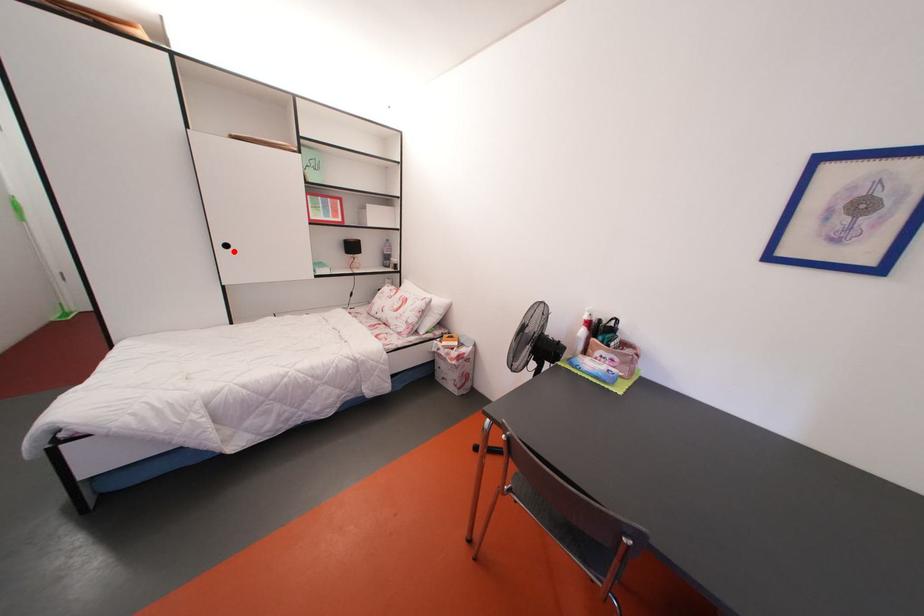
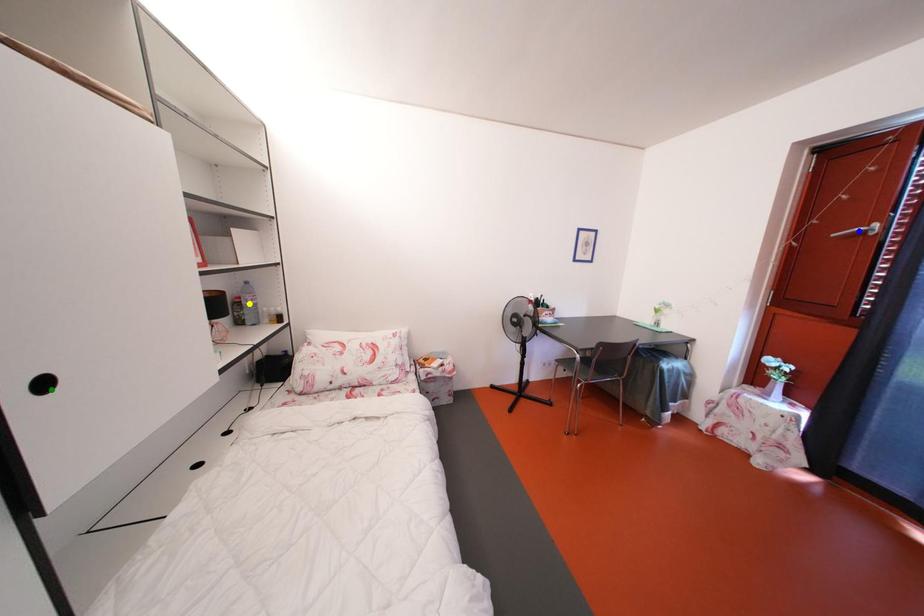
Question: I am providing you with two images of the same scene from different viewpoints. A red point is marked on the first image. You are given multiple points on the second image. Which point in image 2 is actually the same real-world point as the red point in image 1?

Choices:
 (A) green point
 (B) yellow point
 (C) blue point

Answer: (A)